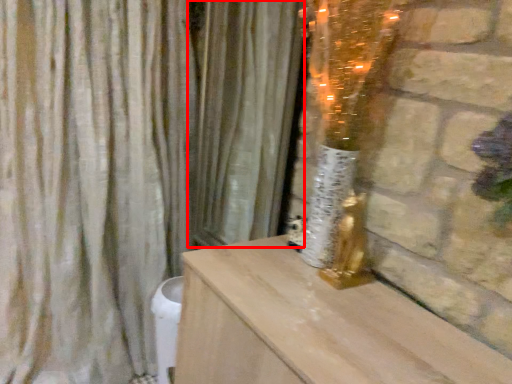
Question: Considering the relative positions of curtain (annotated by the red box) and curtain in the image provided, where is curtain (annotated by the red box) located with respect to the staircase?

Choices:
 (A) left
 (B) right

Answer: (B)